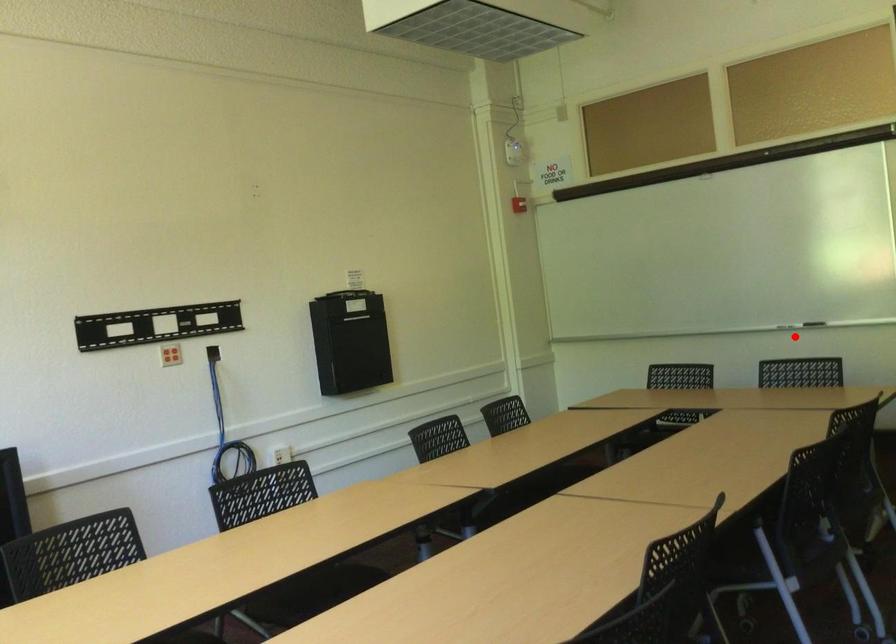
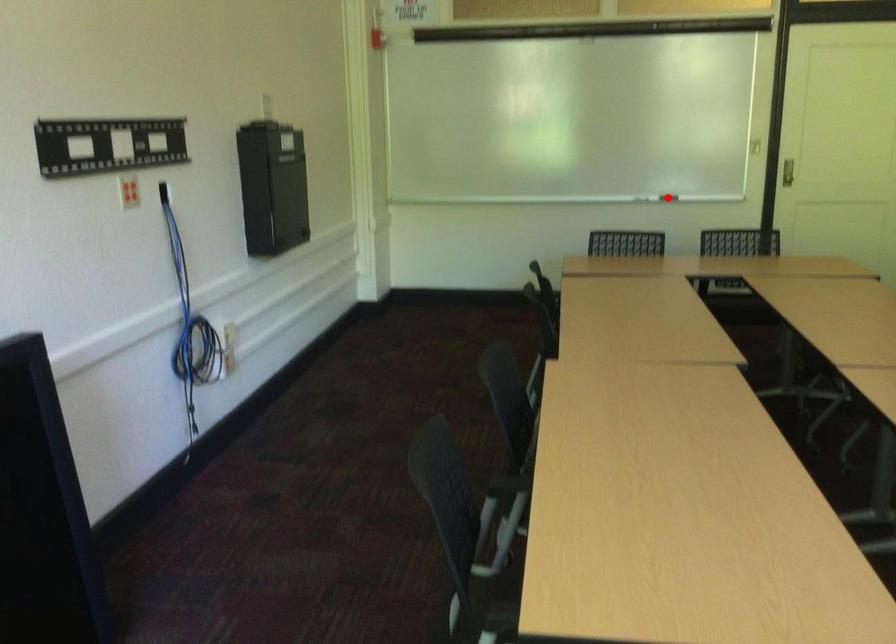
I am providing you with two images of the same scene from different viewpoints. A red point is marked on the first image and another point is marked on the second image. Is the red point in image1 aligned with the point shown in image2?

Yes